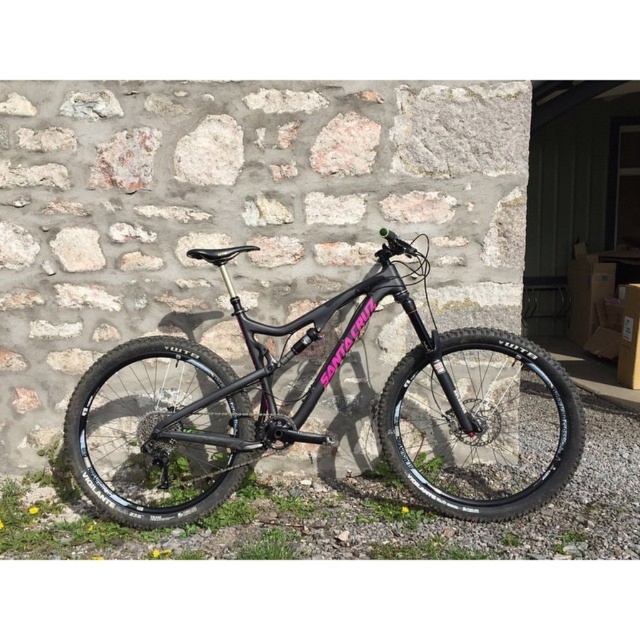
Question: Which object is farther from the camera taking this photo?

Choices:
 (A) matte black mountain bike at center
 (B) black rubber tire at center
 (C) black rubber tire at lower left

Answer: (C)

Question: Is matte black mountain bike at center wider than black rubber tire at lower left?

Choices:
 (A) no
 (B) yes

Answer: (B)

Question: Can you confirm if matte black mountain bike at center is positioned to the right of black rubber tire at center?

Choices:
 (A) yes
 (B) no

Answer: (B)

Question: Estimate the real-world distances between objects in this image. Which object is farther from the black rubber tire at center?

Choices:
 (A) matte black mountain bike at center
 (B) black rubber tire at lower left

Answer: (B)

Question: Is the position of matte black mountain bike at center less distant than that of black rubber tire at center?

Choices:
 (A) no
 (B) yes

Answer: (A)

Question: Which object appears closest to the camera in this image?

Choices:
 (A) black rubber tire at lower left
 (B) matte black mountain bike at center
 (C) black rubber tire at center

Answer: (C)